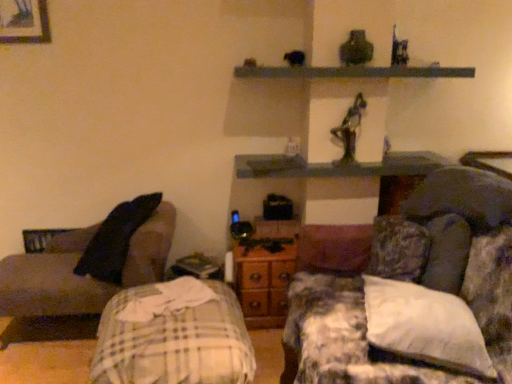
Question: Is fluffy fabric couch at right, arranged as the 1th studio couch when viewed from the right, beside dark gray fabric couch at left, which is counted as the 2th studio couch, starting from the right?

Choices:
 (A) yes
 (B) no

Answer: (B)

Question: Is dark gray fabric couch at left, the 1th studio couch viewed from the left, at the back of fluffy fabric couch at right, arranged as the 1th studio couch when viewed from the right?

Choices:
 (A) yes
 (B) no

Answer: (B)

Question: Considering the relative sizes of fluffy fabric couch at right, arranged as the 2th studio couch when viewed from the left, and dark gray fabric couch at left, the 1th studio couch viewed from the left, in the image provided, is fluffy fabric couch at right, arranged as the 2th studio couch when viewed from the left, bigger than dark gray fabric couch at left, the 1th studio couch viewed from the left,?

Choices:
 (A) no
 (B) yes

Answer: (B)

Question: From a real-world perspective, is fluffy fabric couch at right, arranged as the 1th studio couch when viewed from the right, physically below dark gray fabric couch at left, the 1th studio couch viewed from the left?

Choices:
 (A) yes
 (B) no

Answer: (B)

Question: From a real-world perspective, is fluffy fabric couch at right, arranged as the 1th studio couch when viewed from the right, on dark gray fabric couch at left, which is counted as the 2th studio couch, starting from the right?

Choices:
 (A) yes
 (B) no

Answer: (A)

Question: Is plaid fabric bed at lower left bigger or smaller than dark gray fabric couch at left, which is counted as the 2th studio couch, starting from the right?

Choices:
 (A) big
 (B) small

Answer: (B)

Question: From a real-world perspective, is plaid fabric bed at lower left physically located above or below dark gray fabric couch at left, the 1th studio couch viewed from the left?

Choices:
 (A) above
 (B) below

Answer: (B)

Question: Considering the positions of plaid fabric bed at lower left and dark gray fabric couch at left, the 1th studio couch viewed from the left, in the image, is plaid fabric bed at lower left wider or thinner than dark gray fabric couch at left, the 1th studio couch viewed from the left,?

Choices:
 (A) wide
 (B) thin

Answer: (A)

Question: Is point (190, 297) closer or farther from the camera than point (148, 225)?

Choices:
 (A) closer
 (B) farther

Answer: (A)

Question: Is smooth gray shelf at upper center, the 1th shelf positioned from the top, wider or thinner than wooden dresser at center?

Choices:
 (A) thin
 (B) wide

Answer: (B)

Question: From the image's perspective, is smooth gray shelf at upper center, which is the second shelf from bottom to top, above or below wooden dresser at center?

Choices:
 (A) below
 (B) above

Answer: (B)

Question: In the image, is smooth gray shelf at upper center, which is the second shelf from bottom to top, on the left side or the right side of wooden dresser at center?

Choices:
 (A) left
 (B) right

Answer: (B)

Question: Looking at the image, does smooth gray shelf at upper center, which is the second shelf from bottom to top, seem bigger or smaller compared to wooden dresser at center?

Choices:
 (A) big
 (B) small

Answer: (B)

Question: Visually, is dark gray fabric couch at left, which is counted as the 2th studio couch, starting from the right, positioned to the left or to the right of wooden shelf at center, the 2th shelf viewed from the top?

Choices:
 (A) left
 (B) right

Answer: (A)

Question: From their relative heights in the image, would you say dark gray fabric couch at left, which is counted as the 2th studio couch, starting from the right, is taller or shorter than wooden shelf at center, the 2th shelf viewed from the top?

Choices:
 (A) short
 (B) tall

Answer: (B)